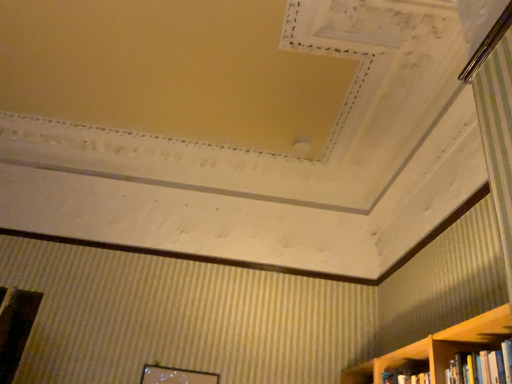
The width and height of the screenshot is (512, 384). I want to click on wooden bookshelf at lower right, so click(x=467, y=338).

The image size is (512, 384). What do you see at coordinates (467, 338) in the screenshot?
I see `wooden bookshelf at lower right` at bounding box center [467, 338].

Identify the location of wooden bookshelf at lower right. The height and width of the screenshot is (384, 512). (467, 338).